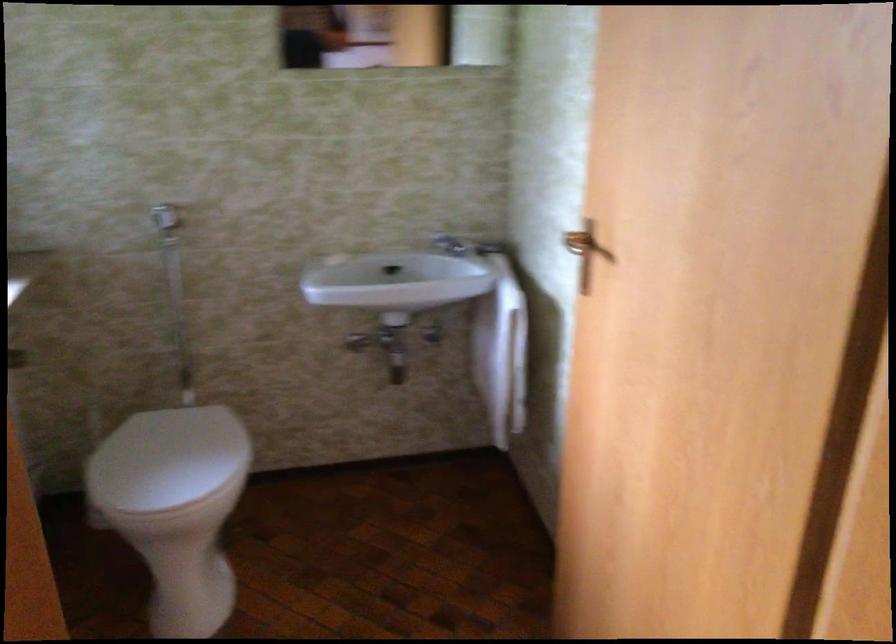
Where would you lift the faucet handle? Please return your answer as a coordinate pair (x, y).

(450, 245)